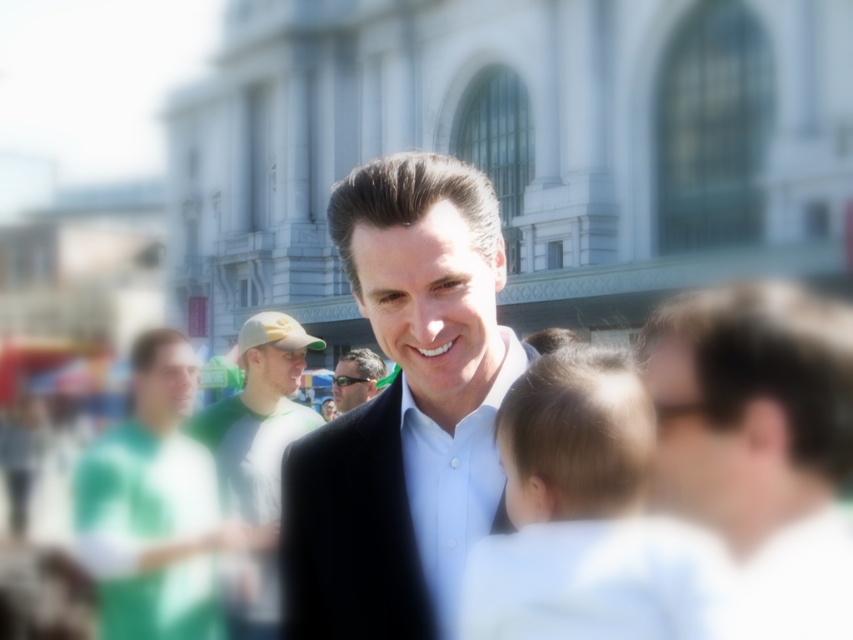
Which is in front, point (688, 314) or point (360, 401)?

Point (688, 314) is more forward.

Between smooth brown hair at center and matte black sunglasses at center, which one is positioned lower?

matte black sunglasses at center is below.

In the scene shown: Measure the distance between point (718, 339) and camera.

Point (718, 339) is 31.77 meters away from camera.

You are a GUI agent. You are given a task and a screenshot of the screen. Output one action in this format:
    pyautogui.click(x=<x>, y=<y>)
    Task: Click on the smooth brown hair at center
    
    Given the screenshot: What is the action you would take?
    pyautogui.click(x=759, y=440)

Between point (527, 508) and point (346, 369), which one is positioned behind?

Positioned behind is point (346, 369).

Is light brown hair at center shorter than matte black sunglasses at center?

In fact, light brown hair at center may be taller than matte black sunglasses at center.

The height and width of the screenshot is (640, 853). I want to click on light brown hair at center, so click(585, 516).

Can you confirm if white cotton shirt at center is positioned to the right of white smooth shirt at center?

In fact, white cotton shirt at center is to the left of white smooth shirt at center.

Who is shorter, white cotton shirt at center or white smooth shirt at center?

With less height is white smooth shirt at center.

Is point (271, 440) farther from viewer compared to point (428, 483)?

Yes.

Where is `white cotton shirt at center`? The height and width of the screenshot is (640, 853). white cotton shirt at center is located at coordinates (258, 417).